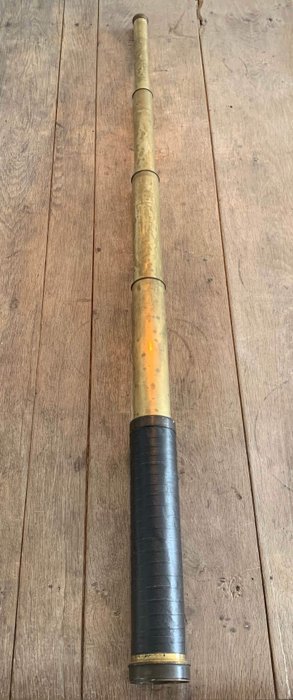
Where is `handle`? This screenshot has width=293, height=700. handle is located at coordinates (150, 631).